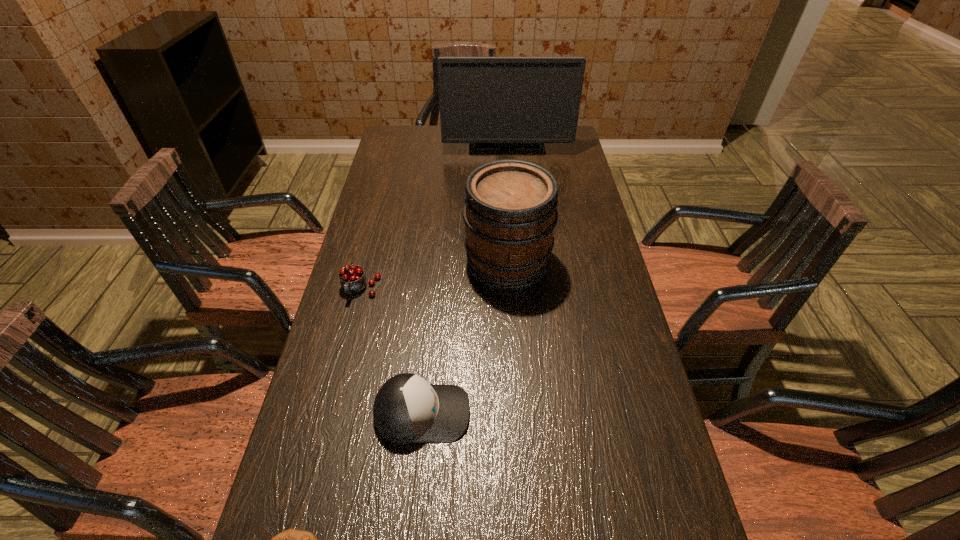
Identify the location of cherry at the left edge. click(x=352, y=278).

Where is `cap present at the left edge`? Image resolution: width=960 pixels, height=540 pixels. cap present at the left edge is located at coordinates (407, 409).

The image size is (960, 540). Identify the location of object present at the right edge. (485, 101).

Image resolution: width=960 pixels, height=540 pixels. Find the location of `object located at the far right corner`. object located at the far right corner is located at coordinates (485, 101).

Locate an element on the screen. Image resolution: width=960 pixels, height=540 pixels. free space at the far edge is located at coordinates (453, 152).

Where is `free location at the left edge of the desktop`? free location at the left edge of the desktop is located at coordinates (411, 221).

Locate an element on the screen. The height and width of the screenshot is (540, 960). free region at the right edge is located at coordinates (621, 388).

Locate an element on the screen. This screenshot has width=960, height=540. vacant region at the far left corner is located at coordinates (427, 136).

The image size is (960, 540). I want to click on free point between the cap and the computer monitor, so click(x=465, y=278).

Image resolution: width=960 pixels, height=540 pixels. Find the location of `vacant region between the second tallest object and the cherry`. vacant region between the second tallest object and the cherry is located at coordinates click(x=434, y=276).